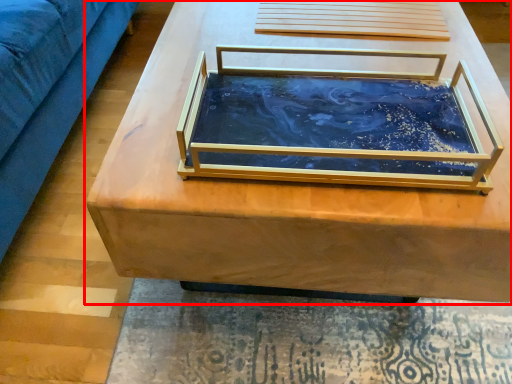
Question: From the image's perspective, what is the correct spatial relationship of table (annotated by the red box) in relation to glass box?

Choices:
 (A) above
 (B) below

Answer: (A)